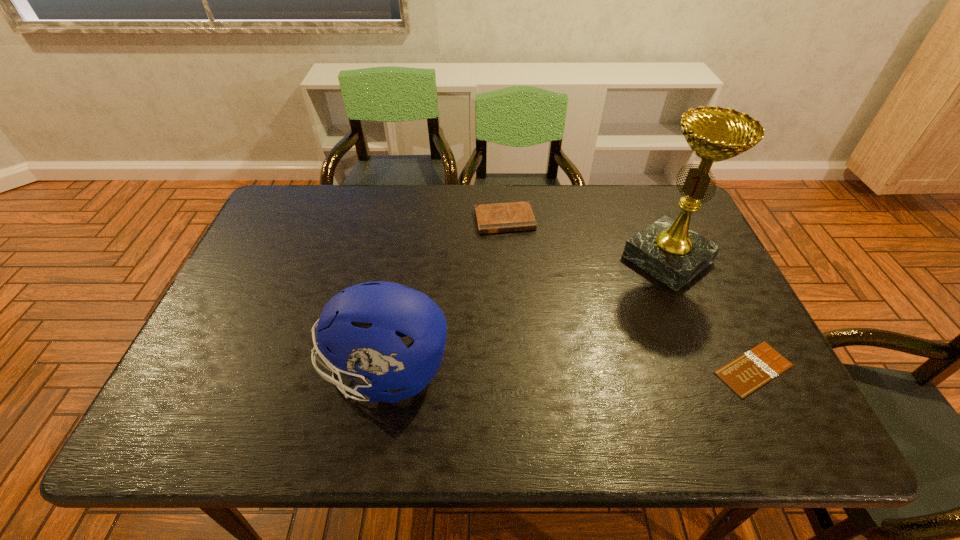
Locate an element on the screen. chocolate bar present at the right edge is located at coordinates (748, 372).

Image resolution: width=960 pixels, height=540 pixels. Find the location of `award located in the right edge section of the desktop`. award located in the right edge section of the desktop is located at coordinates (667, 249).

This screenshot has width=960, height=540. In order to click on object that is at the far right corner in this screenshot , I will do `click(667, 249)`.

Image resolution: width=960 pixels, height=540 pixels. In order to click on object that is at the near right corner in this screenshot , I will do `click(748, 372)`.

You are a GUI agent. You are given a task and a screenshot of the screen. Output one action in this format:
    pyautogui.click(x=<x>, y=<y>)
    Task: Click on the vacant region at the far edge of the desktop
    The height and width of the screenshot is (540, 960).
    Given the screenshot: What is the action you would take?
    pyautogui.click(x=468, y=190)

In the image, there is a desktop. Find the location of `vacant space at the near edge`. vacant space at the near edge is located at coordinates (627, 387).

Locate an element on the screen. The height and width of the screenshot is (540, 960). blank space at the left edge of the desktop is located at coordinates [272, 261].

You are a GUI agent. You are given a task and a screenshot of the screen. Output one action in this format:
    pyautogui.click(x=<x>, y=<y>)
    Task: Click on the free space at the near left corner of the desktop
    
    Given the screenshot: What is the action you would take?
    click(228, 375)

I want to click on vacant space at the far right corner of the desktop, so click(x=648, y=188).

Identify the location of free point between the chocolate bar and the football helmet. (569, 370).